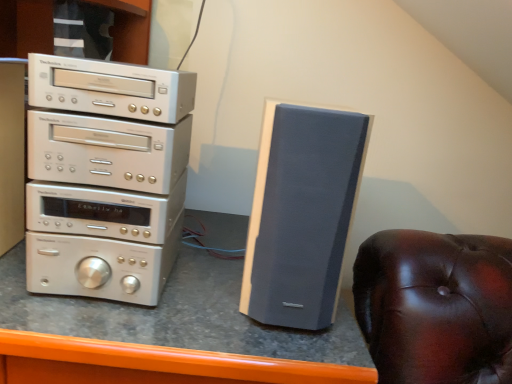
Identify the location of vacant space to the right of silver metallic stereo stack at left. The width and height of the screenshot is (512, 384). (206, 293).